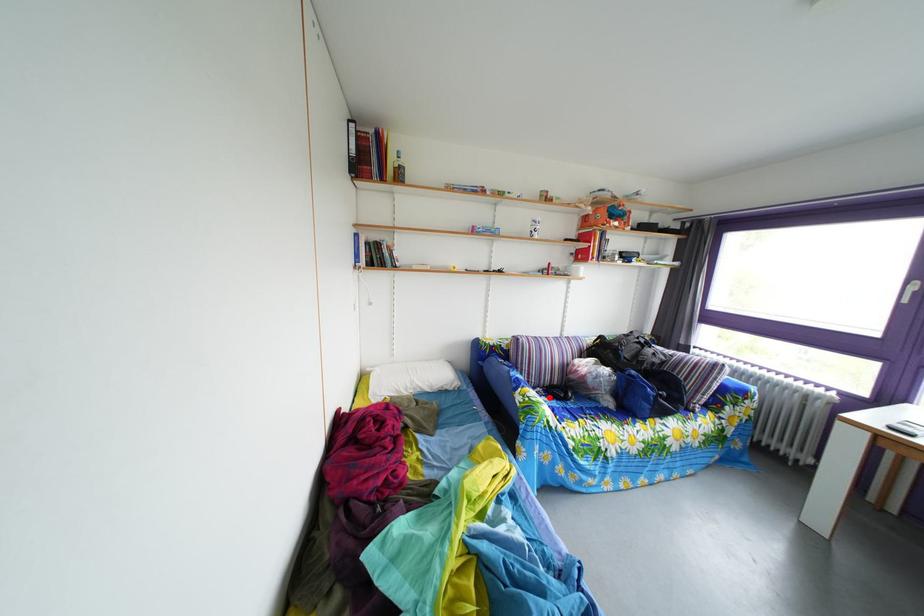
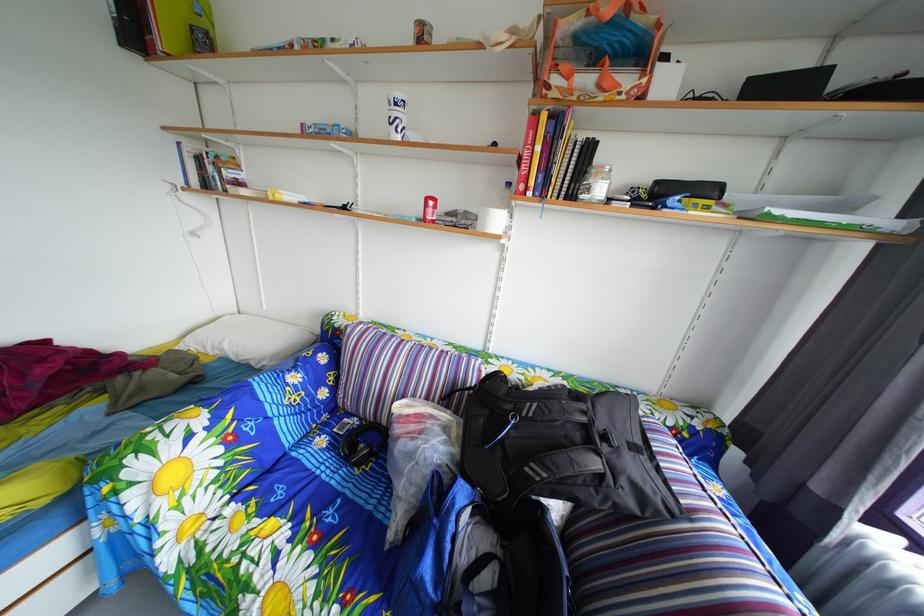
Locate, in the second image, the point that corresponds to the highlighted location in the first image.

(367, 428)